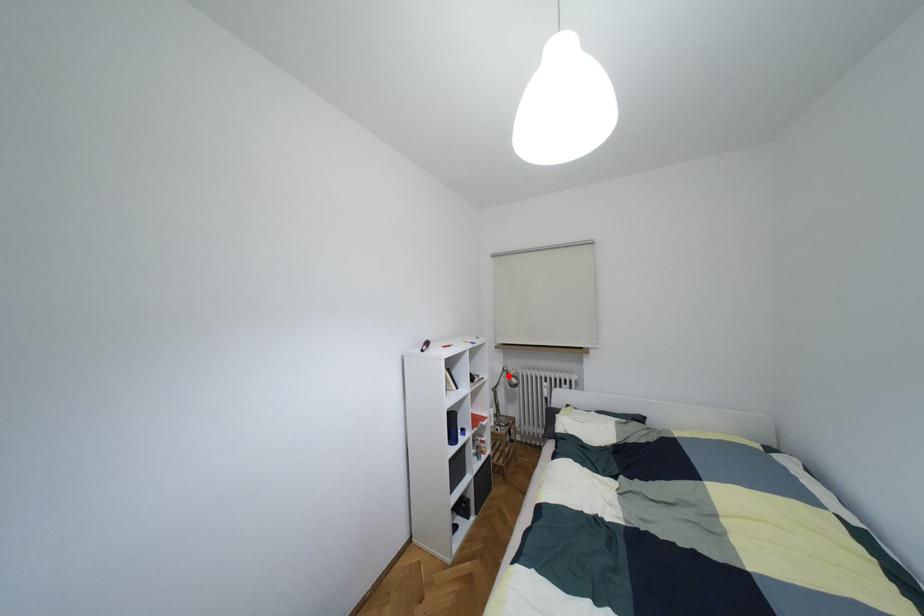
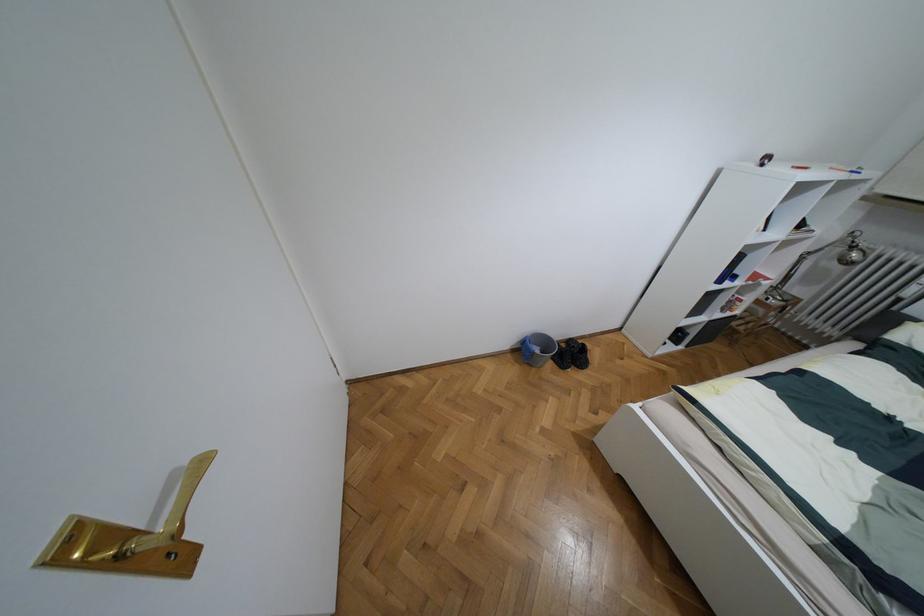
Question: I am providing you with two images of the same scene from different viewpoints. A red point is marked on the first image. Is the red point's position out of view in image 2?

Choices:
 (A) Yes
 (B) No

Answer: (B)